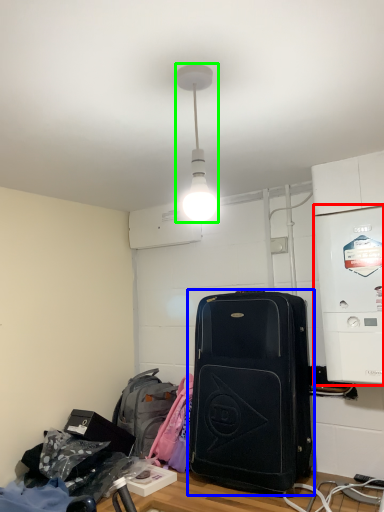
Question: Which is nearer to the appliance (highlighted by a red box)? luggage and bags (highlighted by a blue box) or lamp (highlighted by a green box).

Choices:
 (A) luggage and bags
 (B) lamp

Answer: (A)